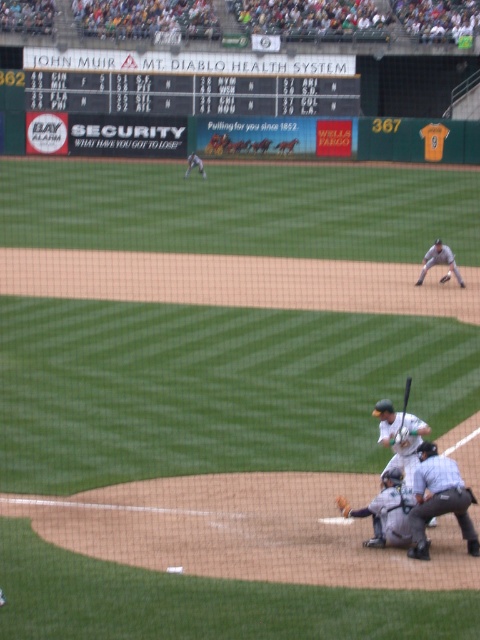
You are a photographer trying to capture a closeup of the gray matte catcher at lower center and the gray uniform glove at right. Which object should you zoom in on to avoid blurring due to its smaller size?

The gray matte catcher at lower center is thinner than the gray uniform glove at right, so you should zoom in on the gray matte catcher at lower center to avoid blurring caused by its smaller size.

You are a photographer trying to capture a wide shot of the baseball game. You notice the gray uniformed umpire at lower right and the white matte baseball bat at lower center in your frame. Based on their sizes in the image, which object should you adjust your camera settings to focus on if you want to ensure both are clearly visible?

The gray uniformed umpire at lower right might be wider than the white matte baseball bat at lower center, so you should adjust your camera settings to focus on the wider object to ensure both are clearly visible.

Consider the image. You are a baseball player standing at home plate. You want to retrieve your white matte baseball bat at lower center but there is a gray uniformed umpire at lower right in your path. Can you reach your bat without stepping into the umpire?

The gray uniformed umpire at lower right and white matte baseball bat at lower center are 20.37 inches apart from each other. Since the distance between them is only 20.37 inches, you would need to step carefully around or between them, but it might be challenging to avoid the umpire while reaching the bat due to the close proximity.